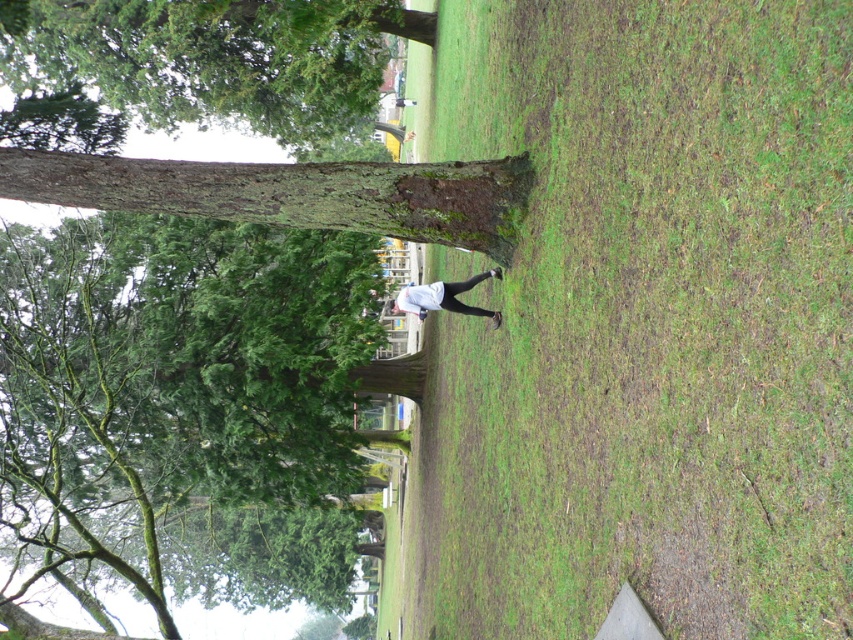
Question: Does brown rough tree trunk at center have a greater width compared to white matte shirt at center?

Choices:
 (A) yes
 (B) no

Answer: (A)

Question: Does brown rough tree trunk at center have a greater width compared to white matte shirt at center?

Choices:
 (A) no
 (B) yes

Answer: (B)

Question: Which object is farther from the camera taking this photo?

Choices:
 (A) green grass at center
 (B) brown rough tree trunk at center
 (C) white matte shirt at center

Answer: (C)

Question: Which object is closer to the camera taking this photo?

Choices:
 (A) white matte shirt at center
 (B) brown rough tree trunk at center
 (C) green grass at center

Answer: (C)

Question: Which of the following is the closest to the observer?

Choices:
 (A) (407, 292)
 (B) (778, 440)

Answer: (B)

Question: Does green grass at center have a greater width compared to brown rough tree trunk at center?

Choices:
 (A) yes
 (B) no

Answer: (B)